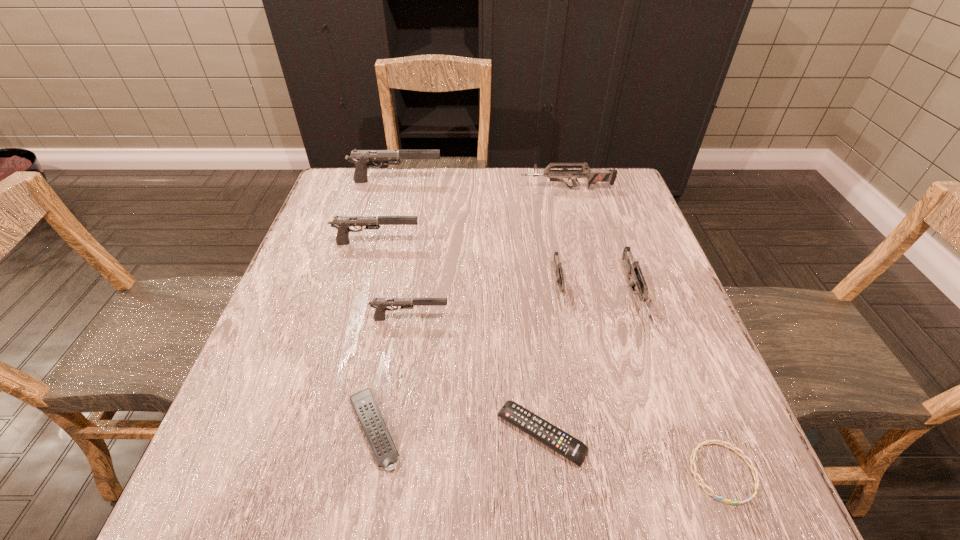
Find the location of a particular element. This screenshot has width=960, height=540. the left remote control is located at coordinates (380, 441).

Find the location of a particular element. the right remote control is located at coordinates (556, 439).

Find the location of a particular element. This screenshot has width=960, height=540. blue bracelet is located at coordinates (722, 443).

Locate an element on the screen. This screenshot has width=960, height=540. free space located 0.120m at the muzzle end of the tallest object is located at coordinates (482, 181).

Find the location of a particular element. vacant region located 0.140m aimed along the barrel of the eighth nearest object is located at coordinates (471, 189).

Find the location of a particular element. The height and width of the screenshot is (540, 960). free location located aimed along the barrel of the eighth nearest object is located at coordinates (447, 189).

Locate an element on the screen. Image resolution: width=960 pixels, height=540 pixels. free space located 0.070m aimed along the barrel of the eighth nearest object is located at coordinates (496, 189).

You are a GUI agent. You are given a task and a screenshot of the screen. Output one action in this format:
    pyautogui.click(x=<x>, y=<y>)
    Task: Click on the free space located 0.320m at the muzzle end of the third farthest gun
    The height and width of the screenshot is (540, 960).
    Given the screenshot: What is the action you would take?
    pyautogui.click(x=548, y=242)

This screenshot has height=540, width=960. In order to click on free space located 0.050m aimed along the barrel of the second biggest grey gun in this screenshot , I will do `click(655, 353)`.

This screenshot has width=960, height=540. In order to click on vacant space positioned 0.160m at the muzzle end of the smallest gray gun in this screenshot , I will do `click(525, 319)`.